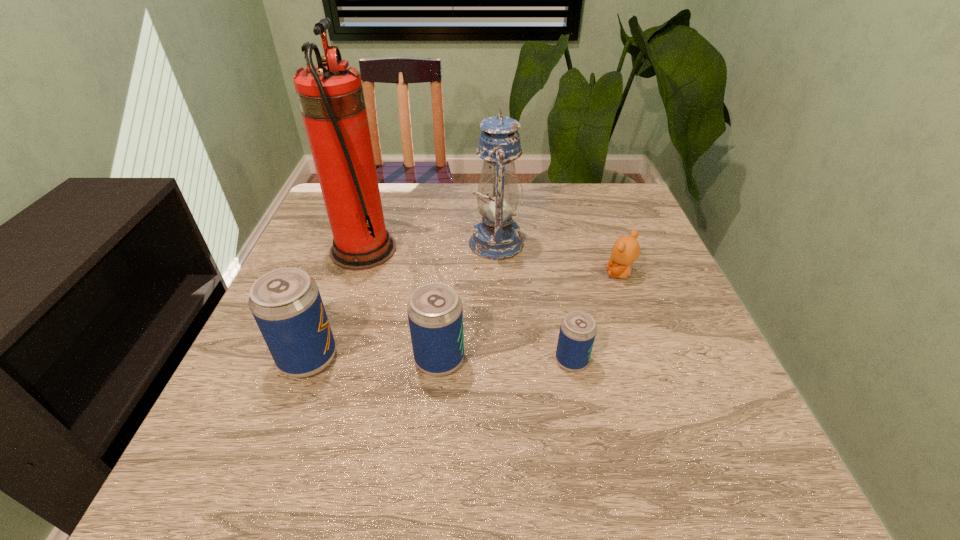
Image resolution: width=960 pixels, height=540 pixels. Identify the location of free space between the rightmost object and the third object from right to left. (558, 258).

Locate an element on the screen. free space between the rightmost object and the tallest object is located at coordinates (492, 262).

The image size is (960, 540). Find the location of `empty space that is in between the tallest object and the second tallest beer can`. empty space that is in between the tallest object and the second tallest beer can is located at coordinates (401, 305).

At what (x,y) coordinates should I click in order to perform the action: click on vacant point located between the rightmost beer can and the tallest object. Please return your answer as a coordinate pair (x, y). Looking at the image, I should click on (468, 305).

At what (x,y) coordinates should I click in order to perform the action: click on vacant region between the rightmost beer can and the third shortest object. Please return your answer as a coordinate pair (x, y). This screenshot has height=540, width=960. Looking at the image, I should click on (506, 360).

This screenshot has width=960, height=540. What are the coordinates of `free space between the fire extinguisher and the leftmost beer can` in the screenshot? It's located at (336, 304).

You are a GUI agent. You are given a task and a screenshot of the screen. Output one action in this format:
    pyautogui.click(x=<x>, y=<y>)
    Task: Click on the free space between the teddy bear and the third object from left to right
    This screenshot has width=960, height=540.
    Given the screenshot: What is the action you would take?
    pyautogui.click(x=530, y=316)

Where is `object that is the second closest one to the second beer can from right to left`? object that is the second closest one to the second beer can from right to left is located at coordinates (577, 333).

Locate an element on the screen. object that ranks as the third closest to the leftmost beer can is located at coordinates (496, 236).

Select which beer can is the closest to the third shortest object. Please provide its 2D coordinates. Your answer should be formatted as a tuple, i.e. [(x, y)], where the tuple contains the x and y coordinates of a point satisfying the conditions above.

[(286, 303)]